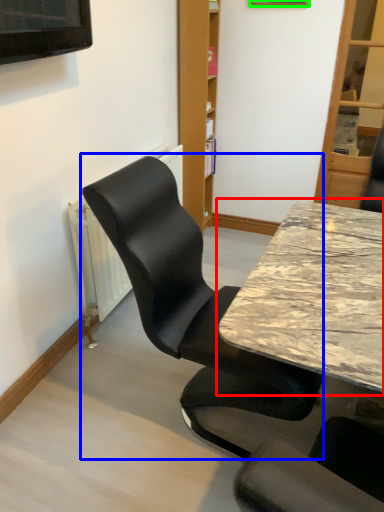
Question: Which object is the closest to the table (highlighted by a red box)? Choose among these: chair (highlighted by a blue box) or picture frame (highlighted by a green box).

Choices:
 (A) chair
 (B) picture frame

Answer: (A)